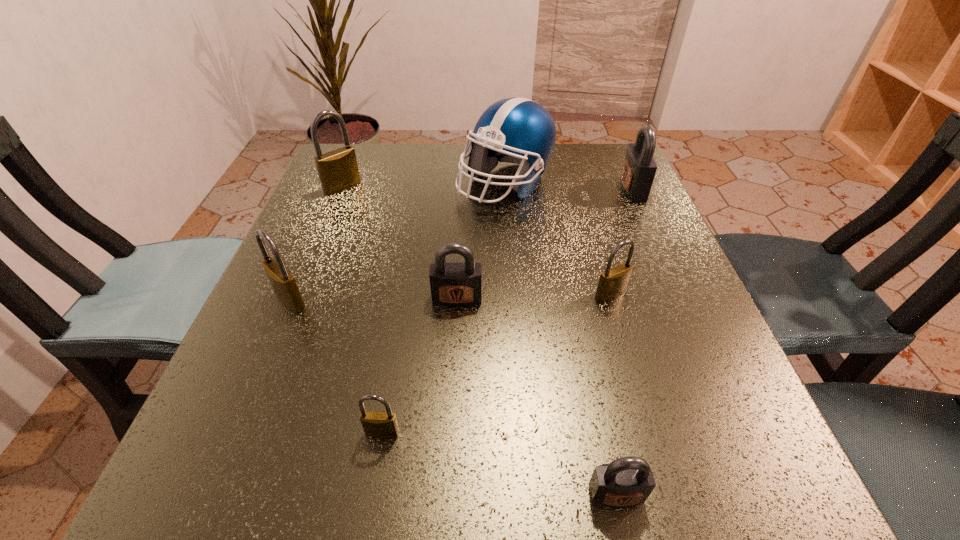
Image resolution: width=960 pixels, height=540 pixels. Identify the location of free space that satisfies the following two spatial constraints: 1. on the back side of the second padlock from right to left; 2. on the left side of the third smallest brass padlock. (293, 294).

Where is `free location that satisfies the following two spatial constraints: 1. on the front of the rightmost object near the keyhole; 2. on the front side of the second object from right to left`? The width and height of the screenshot is (960, 540). free location that satisfies the following two spatial constraints: 1. on the front of the rightmost object near the keyhole; 2. on the front side of the second object from right to left is located at coordinates (681, 294).

The image size is (960, 540). In order to click on blank space that satisfies the following two spatial constraints: 1. at the front of the rightmost brass padlock with the faceguard; 2. on the left side of the blue football helmet in this screenshot , I will do `click(514, 294)`.

The width and height of the screenshot is (960, 540). I want to click on free location that satisfies the following two spatial constraints: 1. on the front of the rightmost padlock near the keyhole; 2. on the front side of the sixth farthest padlock, so click(x=743, y=433).